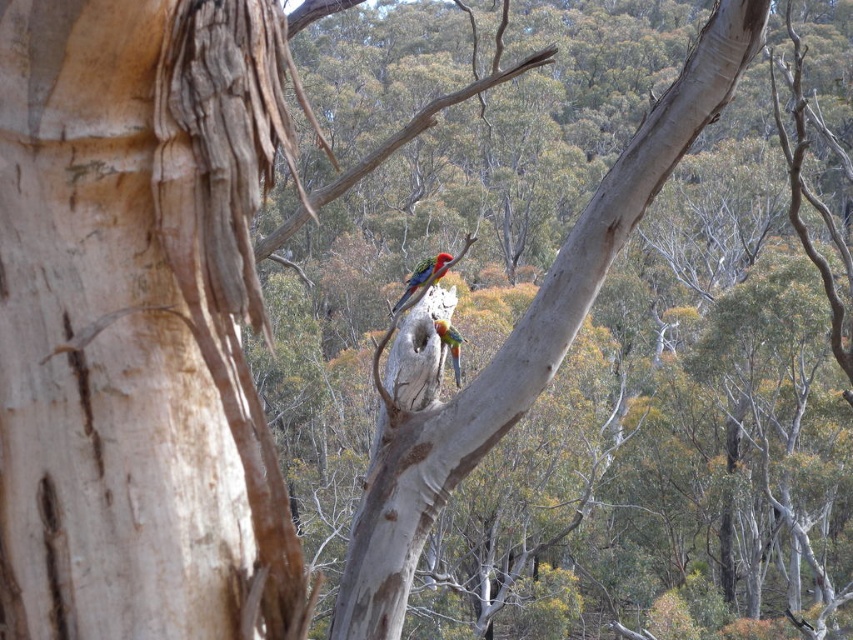
You are an artist trying to paint the scene. You have a small brush that can only cover an area suitable for details smaller than the shiny multicolored parrot at center. Can you use this brush to paint the smooth white bark at left without needing a larger brush?

The smooth white bark at left is narrower than the shiny multicolored parrot at center, so the small brush is sufficient to paint the smooth white bark at left without needing a larger brush.

Based on the scene description, where exactly is the smooth bark tree at center located in terms of coordinates?

The smooth bark tree at center is located at coordinates point (515, 340).